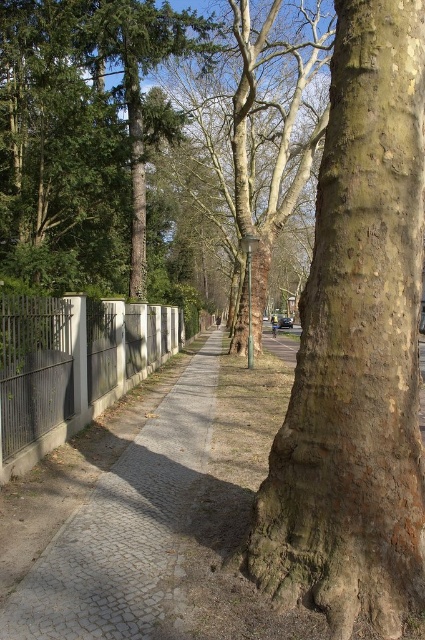
You are a gardener planning to plant a new tree between the smooth bark tree at center and the white concrete fence at left. Based on their current positions, which side of the fence should you place the new tree to maintain alignment with the existing trees?

The smooth bark tree at center is positioned on the right side of the white concrete fence at left. Therefore, to maintain alignment with the existing trees, the new tree should be placed on the right side of the white concrete fence at left, where the smooth bark tree is located.

You are a delivery person trying to navigate through the park. You need to deliver a package to a location behind the white concrete fence at left. Can you walk over the gray cobblestone pavement at center to reach it?

The gray cobblestone pavement at center is not as tall as the white concrete fence at left, so you can walk over the gray cobblestone pavement at center to reach the white concrete fence at left.

You are standing at the base of the large tree trunk in the foreground of the urban park scene. You notice two points marked in the image at coordinates point [96,198] and point [159,420]. Which point is closer to your current position?

Point [96,198] is further to the camera than point [159,420], so the point closer to your current position is point [159,420].